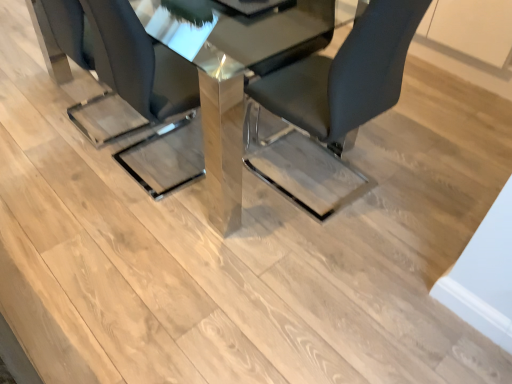
The image size is (512, 384). What do you see at coordinates (330, 109) in the screenshot?
I see `black leather chair at center, which ranks as the 1th chair in right-to-left order` at bounding box center [330, 109].

What is the approximate height of polished glass table at center?

The height of polished glass table at center is 29.35 inches.

This screenshot has width=512, height=384. What do you see at coordinates (236, 79) in the screenshot?
I see `polished glass table at center` at bounding box center [236, 79].

This screenshot has width=512, height=384. Identify the location of matte black chair at center, arranged as the 1th chair when viewed from the left. (127, 88).

Considering the sizes of objects black leather chair at center, which ranks as the 1th chair in right-to-left order, and matte black chair at center, arranged as the 1th chair when viewed from the left, in the image provided, who is thinner, black leather chair at center, which ranks as the 1th chair in right-to-left order, or matte black chair at center, arranged as the 1th chair when viewed from the left,?

black leather chair at center, which ranks as the 1th chair in right-to-left order, is thinner.

Which object is closer to the camera taking this photo, black leather chair at center, which ranks as the 1th chair in right-to-left order, or matte black chair at center, arranged as the 1th chair when viewed from the left?

Positioned in front is black leather chair at center, which ranks as the 1th chair in right-to-left order.

Is black leather chair at center, which ranks as the 1th chair in right-to-left order, turned away from matte black chair at center, arranged as the 1th chair when viewed from the left?

No, matte black chair at center, arranged as the 1th chair when viewed from the left, is not at the back of black leather chair at center, which ranks as the 1th chair in right-to-left order.

Are matte black chair at center, arranged as the 1th chair when viewed from the left, and black leather chair at center, which ranks as the second chair in left-to-right order, far apart?

No, matte black chair at center, arranged as the 1th chair when viewed from the left, is not far from black leather chair at center, which ranks as the second chair in left-to-right order.

Is matte black chair at center, which appears as the 2th chair when viewed from the right, thinner than black leather chair at center, which ranks as the 1th chair in right-to-left order?

In fact, matte black chair at center, which appears as the 2th chair when viewed from the right, might be wider than black leather chair at center, which ranks as the 1th chair in right-to-left order.

In terms of height, does matte black chair at center, which appears as the 2th chair when viewed from the right, look taller or shorter compared to black leather chair at center, which ranks as the second chair in left-to-right order?

In the image, matte black chair at center, which appears as the 2th chair when viewed from the right, appears to be shorter than black leather chair at center, which ranks as the second chair in left-to-right order.

Could you measure the distance between polished glass table at center and black leather chair at center, which ranks as the second chair in left-to-right order?

polished glass table at center and black leather chair at center, which ranks as the second chair in left-to-right order, are 15.48 inches apart.

The image size is (512, 384). I want to click on table behind the black leather chair at center, which ranks as the 1th chair in right-to-left order, so click(x=236, y=79).

Based on the photo, from the image's perspective, is polished glass table at center positioned above or below black leather chair at center, which ranks as the second chair in left-to-right order?

polished glass table at center is above black leather chair at center, which ranks as the second chair in left-to-right order.

Is black leather chair at center, which ranks as the second chair in left-to-right order, at the right side of polished glass table at center?

Indeed, black leather chair at center, which ranks as the second chair in left-to-right order, is positioned on the right side of polished glass table at center.

Is black leather chair at center, which ranks as the 1th chair in right-to-left order, facing away from polished glass table at center?

Yes.

Is black leather chair at center, which ranks as the 1th chair in right-to-left order, positioned before polished glass table at center?

That is True.

Is black leather chair at center, which ranks as the 1th chair in right-to-left order, bigger or smaller than polished glass table at center?

Clearly, black leather chair at center, which ranks as the 1th chair in right-to-left order, is smaller in size than polished glass table at center.

From the image's perspective, is matte black chair at center, which appears as the 2th chair when viewed from the right, located above or below polished glass table at center?

Clearly, from the image's perspective, matte black chair at center, which appears as the 2th chair when viewed from the right, is below polished glass table at center.

Could you tell me if matte black chair at center, arranged as the 1th chair when viewed from the left, is facing polished glass table at center?

Yes, matte black chair at center, arranged as the 1th chair when viewed from the left, is turned towards polished glass table at center.

Considering the sizes of objects matte black chair at center, which appears as the 2th chair when viewed from the right, and polished glass table at center in the image provided, who is wider, matte black chair at center, which appears as the 2th chair when viewed from the right, or polished glass table at center?

With larger width is polished glass table at center.

Is there a large distance between polished glass table at center and matte black chair at center, which appears as the 2th chair when viewed from the right?

That's not correct — polished glass table at center is a little close to matte black chair at center, which appears as the 2th chair when viewed from the right.

Consider the image. From a real-world perspective, between polished glass table at center and matte black chair at center, arranged as the 1th chair when viewed from the left, who is vertically lower?

polished glass table at center.

Identify the location of table on the right of matte black chair at center, arranged as the 1th chair when viewed from the left. The width and height of the screenshot is (512, 384). (236, 79).

This screenshot has height=384, width=512. In the image, there is a black leather chair at center, which ranks as the 1th chair in right-to-left order. What are the coordinates of `chair above it (from the image's perspective)` in the screenshot? It's located at (127, 88).

Where is `chair to the left of black leather chair at center, which ranks as the 1th chair in right-to-left order`? This screenshot has height=384, width=512. chair to the left of black leather chair at center, which ranks as the 1th chair in right-to-left order is located at coordinates (127, 88).

When comparing their distances from matte black chair at center, which appears as the 2th chair when viewed from the right, does polished glass table at center or black leather chair at center, which ranks as the second chair in left-to-right order, seem closer?

polished glass table at center is positioned closer to the anchor matte black chair at center, which appears as the 2th chair when viewed from the right.

When comparing their distances from polished glass table at center, does black leather chair at center, which ranks as the second chair in left-to-right order, or matte black chair at center, which appears as the 2th chair when viewed from the right, seem closer?

black leather chair at center, which ranks as the second chair in left-to-right order, is positioned closer to the anchor polished glass table at center.

Considering their positions, is matte black chair at center, arranged as the 1th chair when viewed from the left, positioned further to polished glass table at center than black leather chair at center, which ranks as the second chair in left-to-right order?

Among the two, matte black chair at center, arranged as the 1th chair when viewed from the left, is located further to polished glass table at center.

From the image, which object appears to be nearer to black leather chair at center, which ranks as the 1th chair in right-to-left order, polished glass table at center or matte black chair at center, arranged as the 1th chair when viewed from the left?

The object closer to black leather chair at center, which ranks as the 1th chair in right-to-left order, is polished glass table at center.

Looking at the image, which one is located closer to matte black chair at center, which appears as the 2th chair when viewed from the right, black leather chair at center, which ranks as the second chair in left-to-right order, or polished glass table at center?

Among the two, polished glass table at center is located nearer to matte black chair at center, which appears as the 2th chair when viewed from the right.

When comparing their distances from black leather chair at center, which ranks as the 1th chair in right-to-left order, does matte black chair at center, which appears as the 2th chair when viewed from the right, or polished glass table at center seem further?

matte black chair at center, which appears as the 2th chair when viewed from the right, lies further to black leather chair at center, which ranks as the 1th chair in right-to-left order, than the other object.

Where is `table between matte black chair at center, which appears as the 2th chair when viewed from the right, and black leather chair at center, which ranks as the 1th chair in right-to-left order`? table between matte black chair at center, which appears as the 2th chair when viewed from the right, and black leather chair at center, which ranks as the 1th chair in right-to-left order is located at coordinates (236, 79).